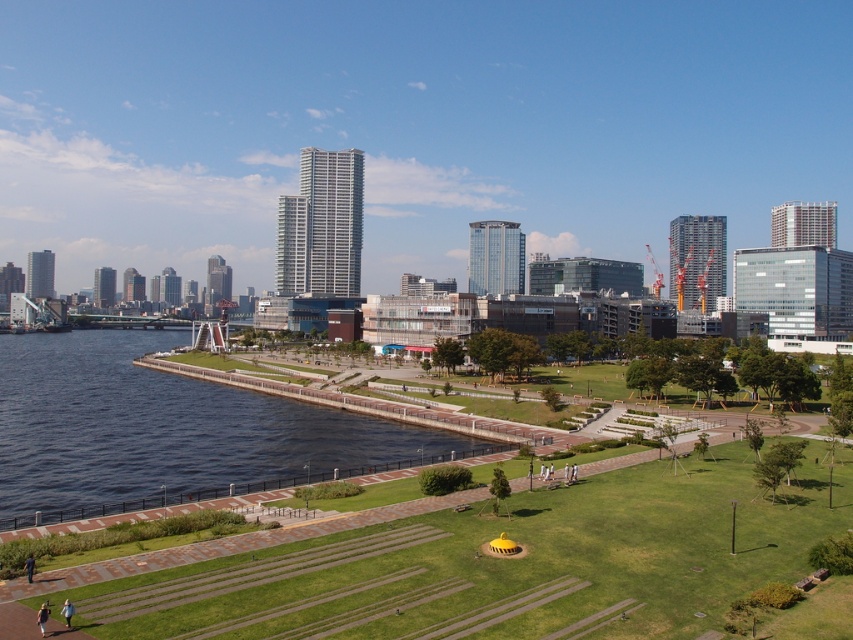
Question: From the image, what is the correct spatial relationship of green grass at lower center in relation to blue glassy water at lower left?

Choices:
 (A) below
 (B) above

Answer: (A)

Question: Which point is closer to the camera?

Choices:
 (A) (10, 435)
 (B) (612, 476)

Answer: (B)

Question: Which point is farther from the camera taking this photo?

Choices:
 (A) (303, 403)
 (B) (384, 529)

Answer: (A)

Question: Can you confirm if green grass at lower center is positioned to the left of blue glassy water at lower left?

Choices:
 (A) no
 (B) yes

Answer: (A)

Question: Can you confirm if green grass at lower center is positioned below blue glassy water at lower left?

Choices:
 (A) yes
 (B) no

Answer: (A)